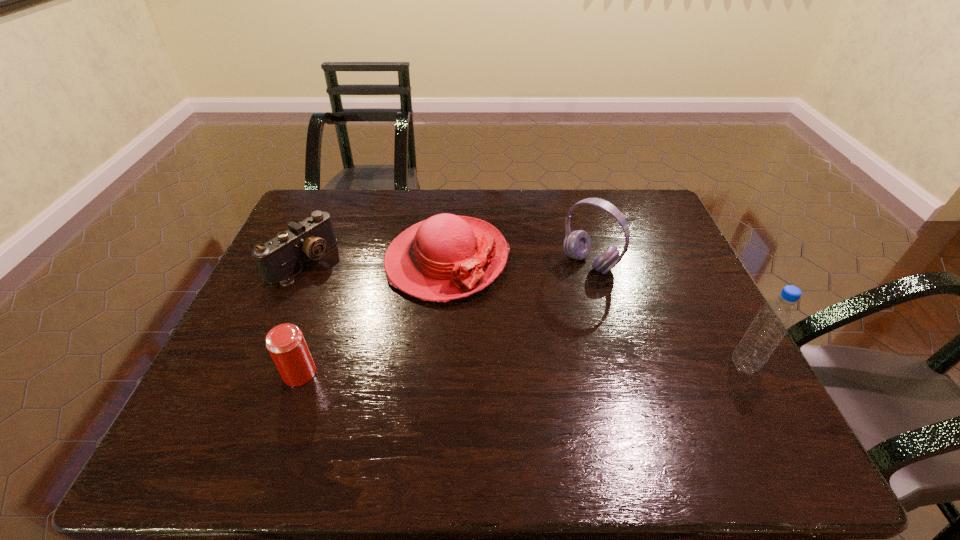
This screenshot has height=540, width=960. Identify the location of vacant space on the desktop that is between the beer can and the water bottle and is positioned on the front-facing side of the camera. (486, 370).

The image size is (960, 540). What are the coordinates of `vacant spot on the desktop that is between the beer can and the rightmost object and is positioned on the headband and ear cups of the headset` in the screenshot? It's located at (470, 370).

In order to click on vacant space on the desktop that is between the beer can and the rightmost object and is positioned at the front of the third object from right to left with a bow in this screenshot , I will do `click(501, 370)`.